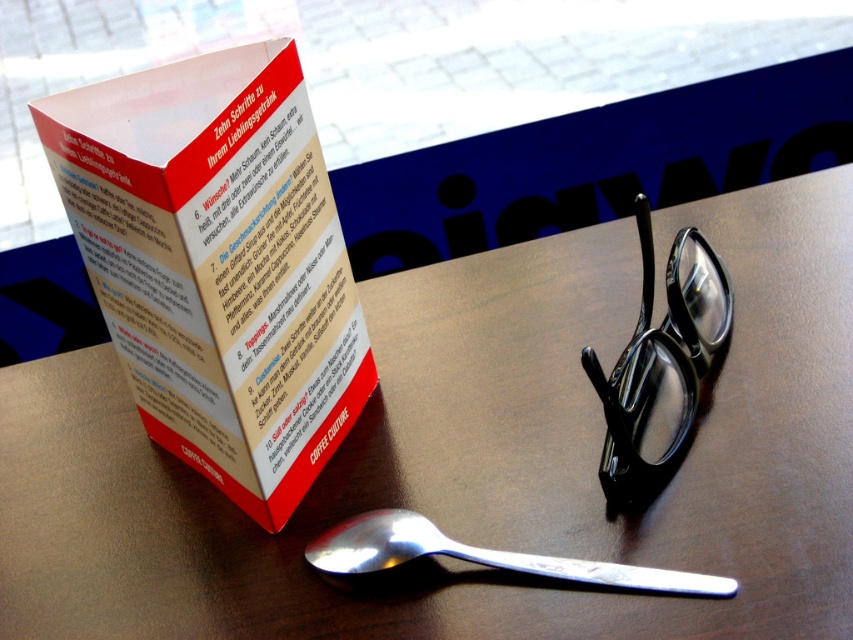
Question: Among these objects, which one is farthest from the camera?

Choices:
 (A) red paper brochure at upper center
 (B) black shiny glasses at center
 (C) silver metallic spoon at lower center

Answer: (B)

Question: Does red paper brochure at upper center appear under silver metallic spoon at lower center?

Choices:
 (A) yes
 (B) no

Answer: (B)

Question: Which point appears closest to the camera in this image?

Choices:
 (A) (608, 452)
 (B) (102, 554)
 (C) (250, 193)

Answer: (C)

Question: Which point is farther to the camera?

Choices:
 (A) (204, 632)
 (B) (125, 339)

Answer: (B)

Question: Is shiny brown table at center to the right of silver metallic spoon at lower center from the viewer's perspective?

Choices:
 (A) yes
 (B) no

Answer: (B)

Question: Is black shiny glasses at center to the left of silver metallic spoon at lower center from the viewer's perspective?

Choices:
 (A) yes
 (B) no

Answer: (B)